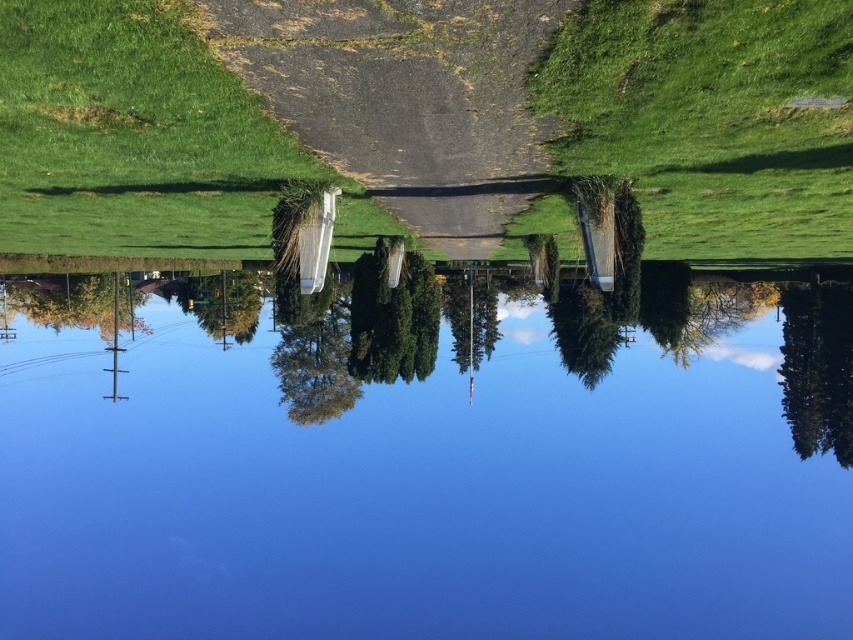
You are standing at the edge of the gravelly asphalt path at center and want to walk towards the green grass at upper left. Which direction should you head?

You should head towards the upper left direction since the green grass at upper left is located in that direction.

You are standing at the point labeled point (724, 49) and want to walk to the point labeled point (103, 93). Based on the scene, which direction should you head to reach your destination?

Since point (724, 49) is closer to the camera than point (103, 93), you should head away from the camera to reach point (103, 93).